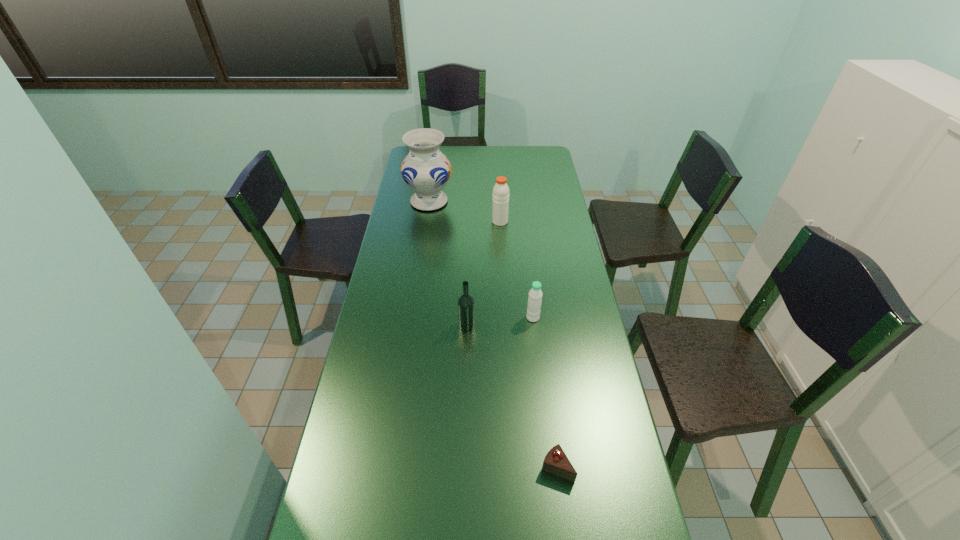
This screenshot has width=960, height=540. In order to click on object that is the fourth closest to the water bottle in this screenshot , I will do `click(426, 170)`.